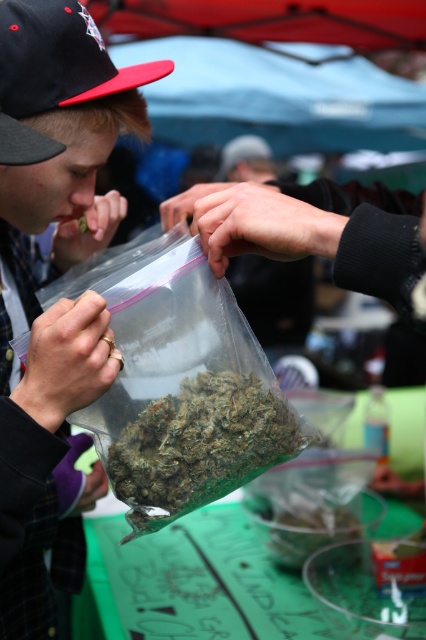
Question: Can you confirm if green matte marijuana at center is positioned below black fabric baseball cap at upper left?

Choices:
 (A) no
 (B) yes

Answer: (B)

Question: Among these objects, which one is farthest from the camera?

Choices:
 (A) black fabric baseball cap at upper left
 (B) green matte marijuana at center

Answer: (A)

Question: Which point is closer to the camera?

Choices:
 (A) (100, 65)
 (B) (178, 432)

Answer: (B)

Question: Does green matte marijuana at center have a smaller size compared to black fabric baseball cap at upper left?

Choices:
 (A) yes
 (B) no

Answer: (A)

Question: Is green matte marijuana at center above black fabric baseball cap at upper left?

Choices:
 (A) no
 (B) yes

Answer: (A)